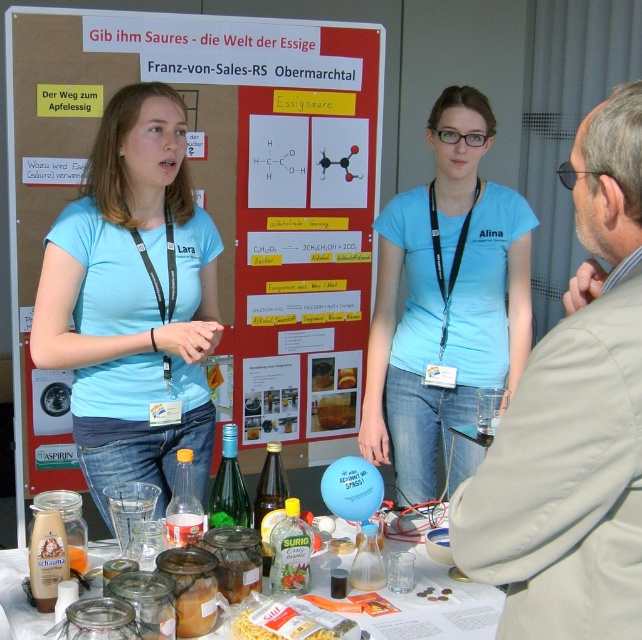
Based on the photo, is green glass bottle at center shorter than transparent glass bottle at center?

No.

Is point (238, 492) positioned before point (369, 541)?

No, it is behind (369, 541).

Locate an element on the screen. The width and height of the screenshot is (642, 640). green glass bottle at center is located at coordinates (229, 486).

Between beige fabric coat at upper right and translucent plastic bottle at lower center, which one is positioned higher?

beige fabric coat at upper right

Is beige fabric coat at upper right closer to camera compared to translucent plastic bottle at lower center?

Yes.

Is point (596, 419) positioned after point (187, 520)?

No, it is in front of (187, 520).

Identify the location of beige fabric coat at upper right. The height and width of the screenshot is (640, 642). (573, 420).

Is point (417, 582) positioned before point (297, 580)?

That is False.

Based on the photo, who is lower down, translucent glass jars at lower center or translucent plastic jar at center?

Positioned lower is translucent glass jars at lower center.

Does point (6, 573) lie in front of point (291, 564)?

No, it is behind (291, 564).

Locate an element on the screen. The width and height of the screenshot is (642, 640). translucent glass jars at lower center is located at coordinates (440, 588).